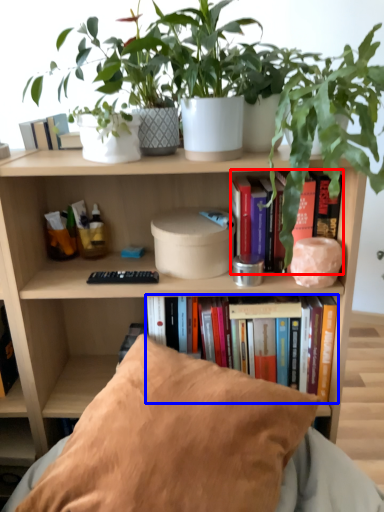
Question: Which point is closer to the camera, book (highlighted by a red box) or book (highlighted by a blue box)?

Choices:
 (A) book
 (B) book

Answer: (A)